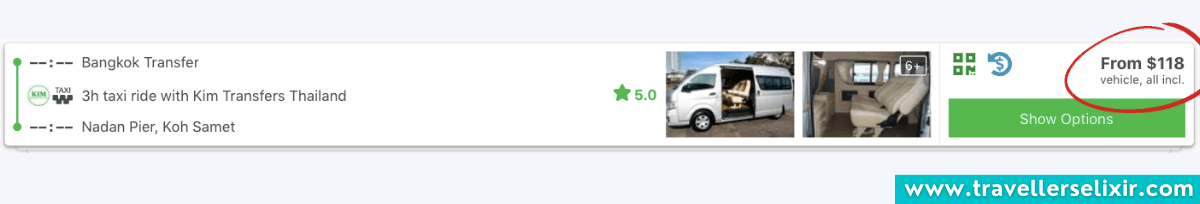
The width and height of the screenshot is (1200, 204). What are the coordinates of `seat` in the screenshot? It's located at (874, 118).